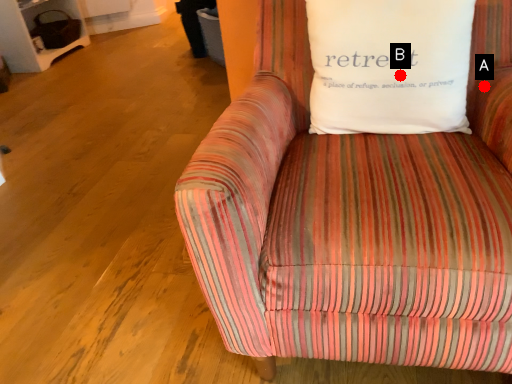
Question: Two points are circled on the image, labeled by A and B beside each circle. Which point is closer to the camera?

Choices:
 (A) A is closer
 (B) B is closer

Answer: (B)